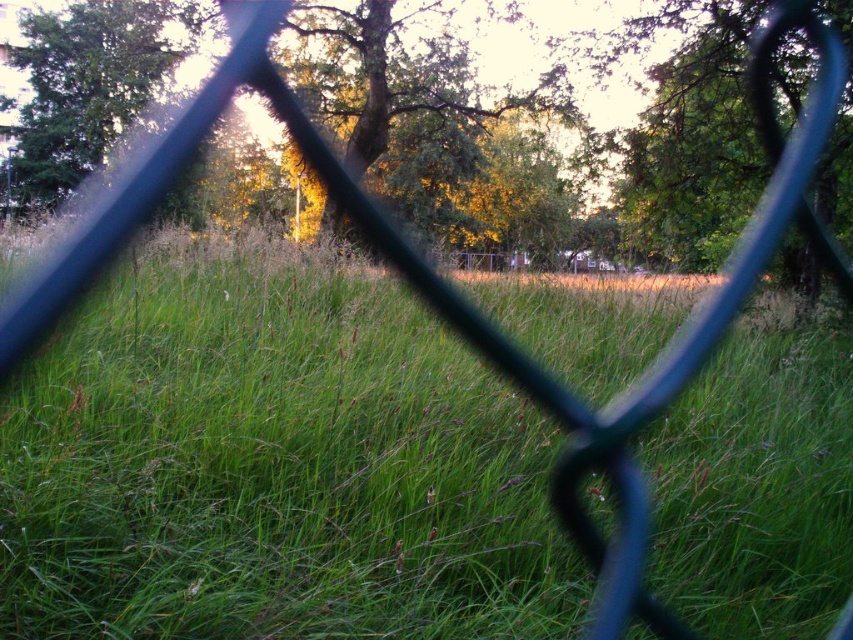
Question: Which point appears farthest from the camera in this image?

Choices:
 (A) (45, 609)
 (B) (16, 163)

Answer: (B)

Question: Is green grassy at center positioned behind green leafy tree at upper left?

Choices:
 (A) no
 (B) yes

Answer: (A)

Question: Does green grassy at center appear on the right side of green leafy tree at upper left?

Choices:
 (A) yes
 (B) no

Answer: (A)

Question: Can you confirm if green grassy at center is positioned above green leafy tree at upper left?

Choices:
 (A) no
 (B) yes

Answer: (A)

Question: Which object is closer to the camera taking this photo?

Choices:
 (A) green leafy tree at upper left
 (B) green grassy at center

Answer: (B)